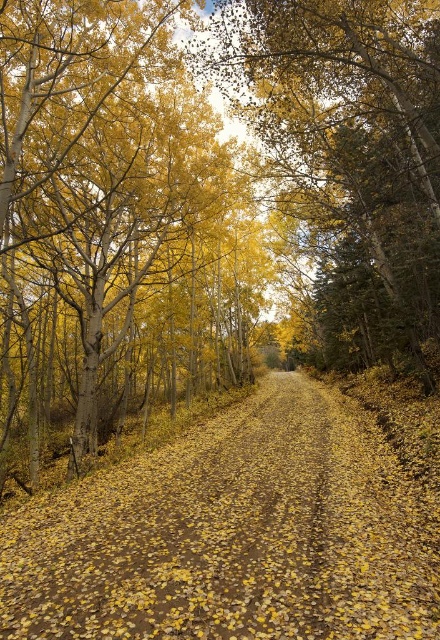
Question: Which of the following is the closest to the observer?

Choices:
 (A) golden textured leaves at center
 (B) yellow leafy dirt path at center

Answer: (B)

Question: Which point is closer to the camera taking this photo?

Choices:
 (A) (209, 444)
 (B) (359, 328)

Answer: (A)

Question: Does yellow leafy dirt path at center have a lesser width compared to golden textured leaves at center?

Choices:
 (A) no
 (B) yes

Answer: (B)

Question: Can you confirm if yellow leafy dirt path at center is bigger than golden textured leaves at center?

Choices:
 (A) yes
 (B) no

Answer: (B)

Question: Does yellow leafy dirt path at center appear over golden textured leaves at center?

Choices:
 (A) no
 (B) yes

Answer: (A)

Question: Among these points, which one is farthest from the camera?

Choices:
 (A) (285, 625)
 (B) (268, 35)

Answer: (B)